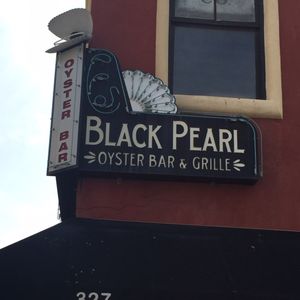
Image resolution: width=300 pixels, height=300 pixels. Find the location of `frame around window`. frame around window is located at coordinates (250, 108).